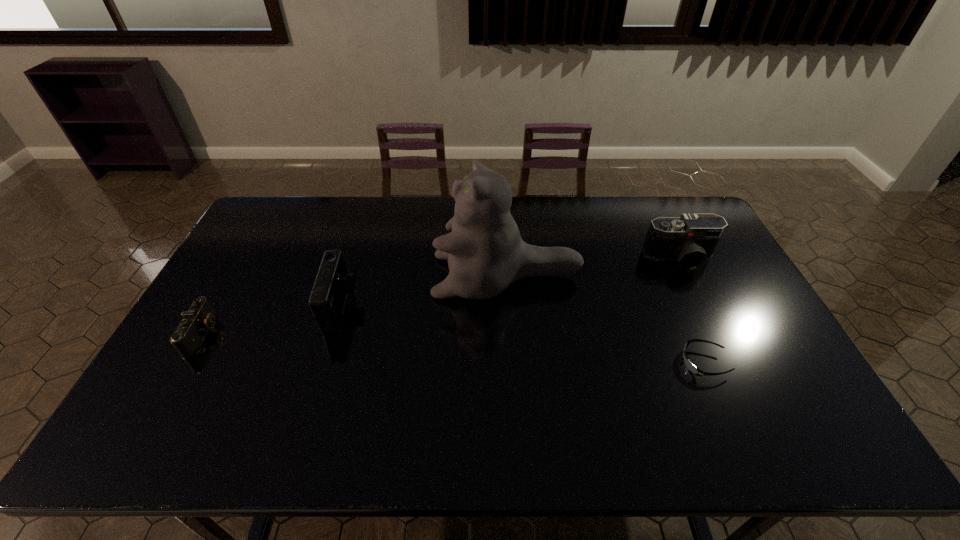
Identify which object is located as the third nearest to the second camera from left to right. Please provide its 2D coordinates. Your answer should be formatted as a tuple, i.e. [(x, y)], where the tuple contains the x and y coordinates of a point satisfying the conditions above.

[(689, 365)]

Image resolution: width=960 pixels, height=540 pixels. Identify the location of camera identified as the closest to the leftmost object. (333, 283).

Locate which camera is the closest to the second shortest object. Please provide its 2D coordinates. Your answer should be formatted as a tuple, i.e. [(x, y)], where the tuple contains the x and y coordinates of a point satisfying the conditions above.

[(333, 283)]

You are a GUI agent. You are given a task and a screenshot of the screen. Output one action in this format:
    pyautogui.click(x=<x>, y=<y>)
    Task: Click on the vacant area in the image that satisfies the following two spatial constraints: 1. on the front-facing side of the rightmost camera; 2. on the front-facing side of the second object from left to right
    
    Given the screenshot: What is the action you would take?
    pyautogui.click(x=704, y=307)

This screenshot has width=960, height=540. Find the location of `vacant space that satisfies the following two spatial constraints: 1. on the front-facing side of the rightmost camera; 2. on the face of the third object from left to right`. vacant space that satisfies the following two spatial constraints: 1. on the front-facing side of the rightmost camera; 2. on the face of the third object from left to right is located at coordinates (688, 276).

Locate an element on the screen. The image size is (960, 540). free space that satisfies the following two spatial constraints: 1. on the front-facing side of the farthest camera; 2. on the lenses of the shortest object is located at coordinates (732, 363).

The width and height of the screenshot is (960, 540). I want to click on free space in the image that satisfies the following two spatial constraints: 1. on the front-facing side of the farthest camera; 2. on the front-facing side of the leftmost object, so click(x=717, y=334).